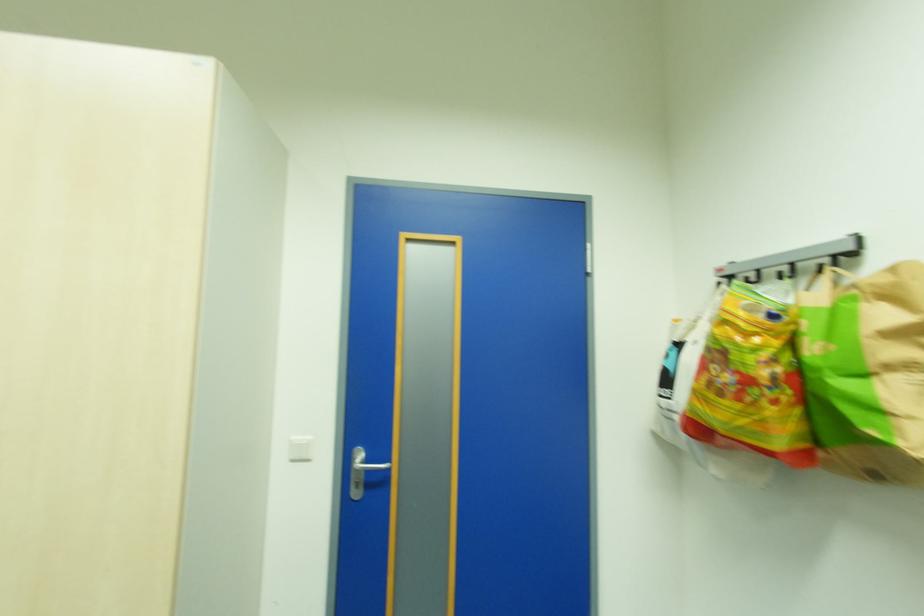
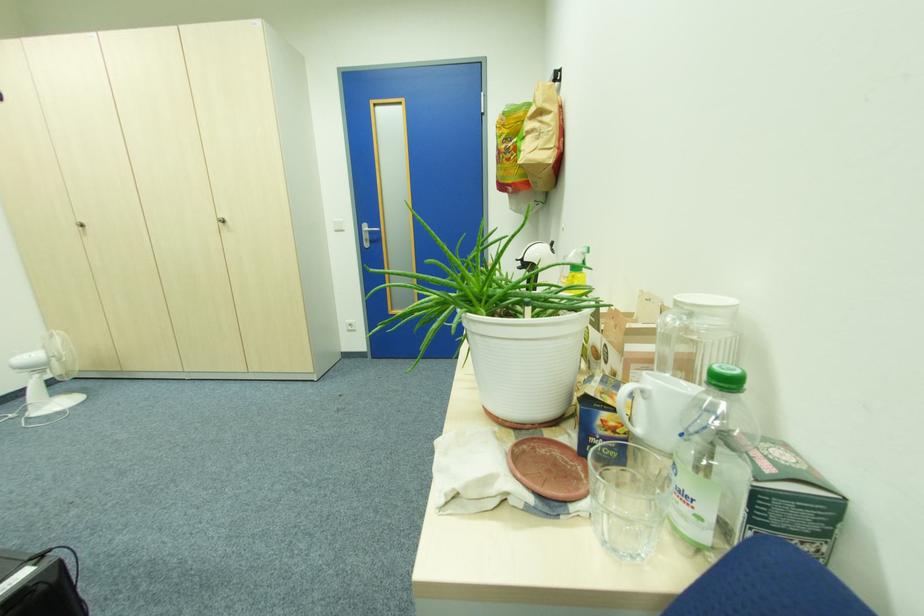
In the second image, find the point that corresponds to point 363,458 in the first image.

(371, 229)